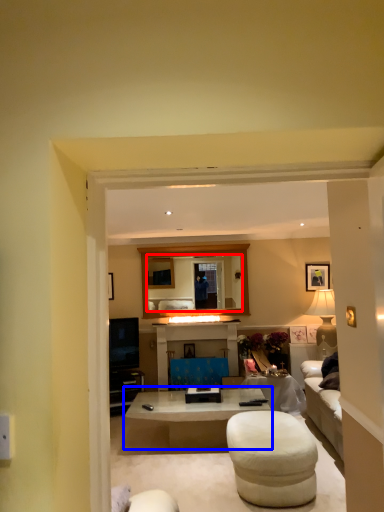
Question: Which object appears farthest to the camera in this image, mirror (highlighted by a red box) or coffee table (highlighted by a blue box)?

Choices:
 (A) mirror
 (B) coffee table

Answer: (A)